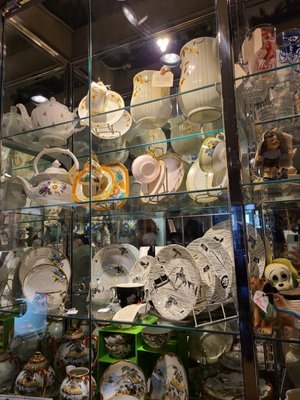
At what (x,y) coordinates should I click in order to perform the action: click on shelves. Please return your answer as a coordinate pair (x, y). This screenshot has width=300, height=400. Looking at the image, I should click on [62, 123], [63, 316].